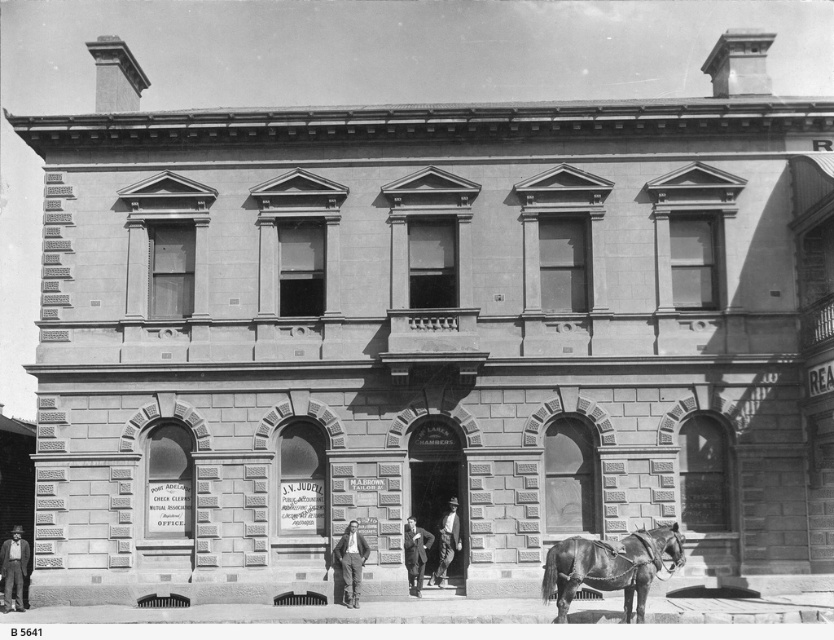
Is dark suit at center thinner than light brown leather coat at center?

No, dark suit at center is not thinner than light brown leather coat at center.

Who is shorter, dark suit at center or light brown leather coat at center?

dark suit at center

Who is more forward, (410, 516) or (440, 554)?

Point (410, 516)

You are a GUI agent. You are given a task and a screenshot of the screen. Output one action in this format:
    pyautogui.click(x=<x>, y=<y>)
    Task: Click on the dark suit at center
    This screenshot has width=834, height=640.
    Given the screenshot: What is the action you would take?
    pyautogui.click(x=415, y=554)

Which is in front, point (9, 579) or point (453, 529)?

Point (453, 529) is more forward.

Is dark brown leather hat at lower left wider than light brown leather coat at center?

Correct, the width of dark brown leather hat at lower left exceeds that of light brown leather coat at center.

Who is more distant from viewer, (x=8, y=586) or (x=450, y=548)?

The point (x=8, y=586) is more distant.

Locate an element on the screen. The image size is (834, 640). dark brown leather hat at lower left is located at coordinates (13, 568).

Does point (8, 577) lie in front of point (423, 572)?

That is False.

Does dark brown leather hat at lower left appear on the right side of dark suit at center?

No, dark brown leather hat at lower left is not to the right of dark suit at center.

The height and width of the screenshot is (640, 834). What do you see at coordinates (13, 568) in the screenshot?
I see `dark brown leather hat at lower left` at bounding box center [13, 568].

I want to click on dark brown leather hat at lower left, so click(x=13, y=568).